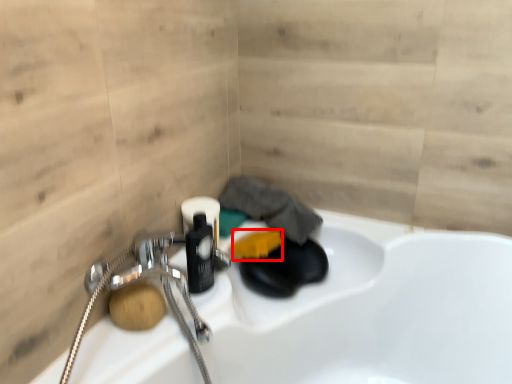
Question: In this image, where is soap (annotated by the red box) located relative to soap?

Choices:
 (A) left
 (B) right

Answer: (B)